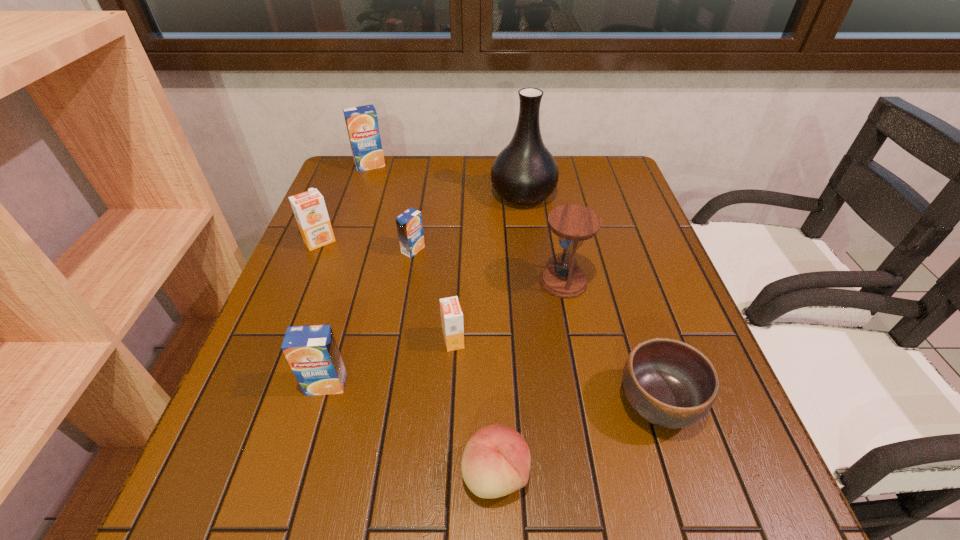
The width and height of the screenshot is (960, 540). What are the coordinates of `free area in between the tallest orange juice and the peach` in the screenshot? It's located at (433, 320).

Identify the location of free space between the second farthest blue orange_juice and the farthest object. (392, 207).

At what (x,y) coordinates should I click in order to perform the action: click on unoccupied area between the peach and the smallest blue orange_juice. Please return your answer as a coordinate pair (x, y). Image resolution: width=960 pixels, height=540 pixels. Looking at the image, I should click on (454, 362).

Find the location of `empty location between the nearest orange juice and the farthest orange juice`. empty location between the nearest orange juice and the farthest orange juice is located at coordinates (348, 275).

Choose which object is the sixth nearest neighbor to the fifth farthest object. Please provide its 2D coordinates. Your answer should be formatted as a tuple, i.e. [(x, y)], where the tuple contains the x and y coordinates of a point satisfying the conditions above.

[(312, 352)]

At what (x,y) coordinates should I click in order to perform the action: click on object that stands as the third closest to the bowl. Please return your answer as a coordinate pair (x, y). Looking at the image, I should click on (451, 314).

In order to click on orange juice identified as the fifth closest to the hourglass in this screenshot , I will do `click(362, 125)`.

Point out which orange juice is positioned as the second nearest to the farthest object. Please provide its 2D coordinates. Your answer should be formatted as a tuple, i.e. [(x, y)], where the tuple contains the x and y coordinates of a point satisfying the conditions above.

[(409, 224)]

Identify the location of blue orange_juice that is the second closest to the right orange orange juice. coord(409,224).

This screenshot has width=960, height=540. Find the location of `the third closest blue orange_juice to the hourglass`. the third closest blue orange_juice to the hourglass is located at coordinates (362, 125).